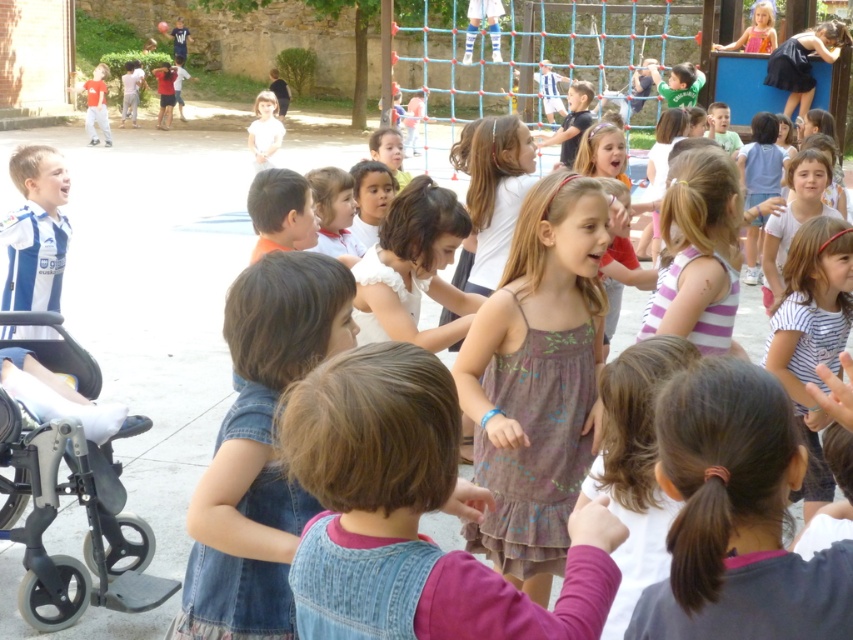
You are a photographer taking a picture of the playground scene. You notice the brown textured dress at center and the pink fabric dress at upper right. Which dress should you focus on first to ensure it appears larger in the photo?

The brown textured dress at center should be focused on first because it is closer to the viewer, making it appear larger in the photo compared to the pink fabric dress at upper right which is farther away.

You are a parent trying to keep an eye on your child. You are standing near the gray metallic baby carriage at lower left. Can you see the brown textured dress at center from your current position?

The brown textured dress at center and gray metallic baby carriage at lower left are 1.78 meters apart from each other, so yes, you can see the brown textured dress at center from your current position as the distance is relatively short.

You are a parent at the playground and see your child playing near the gray metallic baby carriage at lower left and the pink fabric dress at upper right. Which object is positioned lower in the image?

The gray metallic baby carriage at lower left is located below the pink fabric dress at upper right, so the gray metallic baby carriage at lower left is positioned lower in the image.